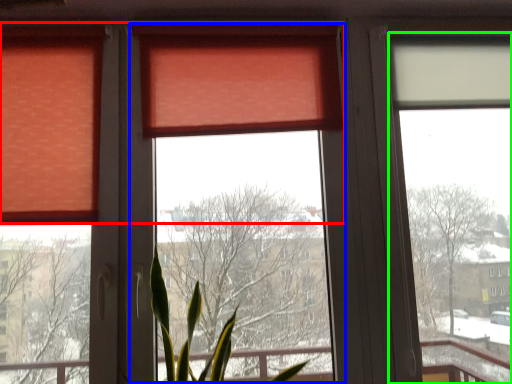
Question: Which is nearer to the curtain (highlighted by a red box)? window screen (highlighted by a blue box) or window screen (highlighted by a green box).

Choices:
 (A) window screen
 (B) window screen

Answer: (A)